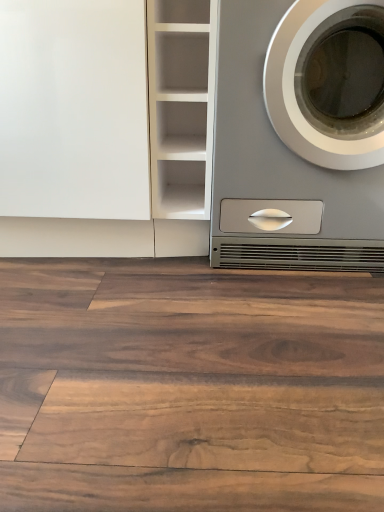
You are a GUI agent. You are given a task and a screenshot of the screen. Output one action in this format:
    pyautogui.click(x=<x>, y=<y>)
    Task: Click on the free space above brown wood flooring at center (from a real-world perspective)
    This screenshot has height=512, width=384.
    Given the screenshot: What is the action you would take?
    pyautogui.click(x=193, y=326)